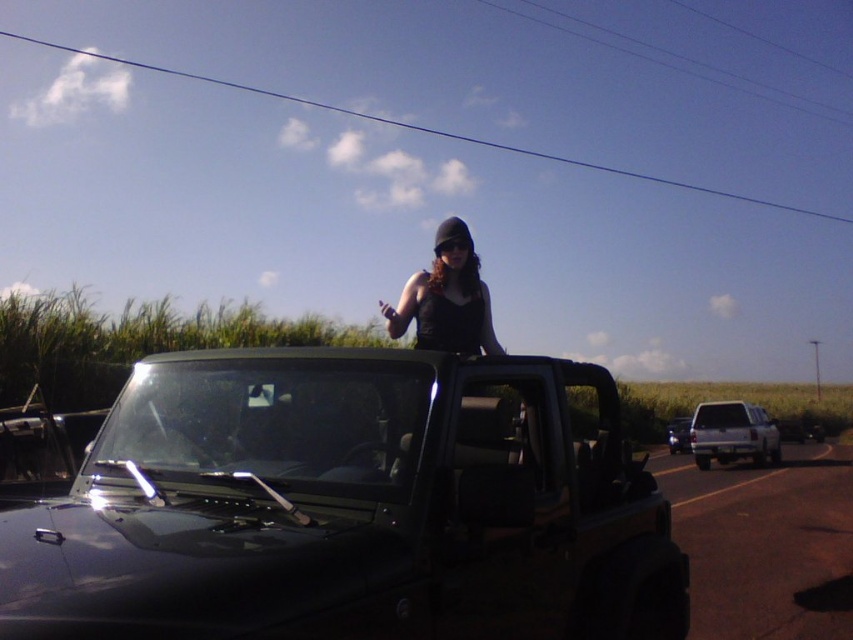
You are a photographer trying to capture a photo of the black matte jeep at center and the white matte truck at right. From your current position, which vehicle is closer to the left side of the frame?

The black matte jeep at center is to the left of the white matte truck at right, so the black matte jeep at center is closer to the left side of the frame.

You are driving a car and want to take a photo of both the black matte jeep at center and the silver metallic truck at right. Since you can only position your car in one spot, which vehicle should you aim to be closer to so that both are visible in your camera frame?

You should position your car closer to the black matte jeep at center because it is located to the left of the silver metallic truck at right, so being closer to the left vehicle allows both to be captured in the frame.